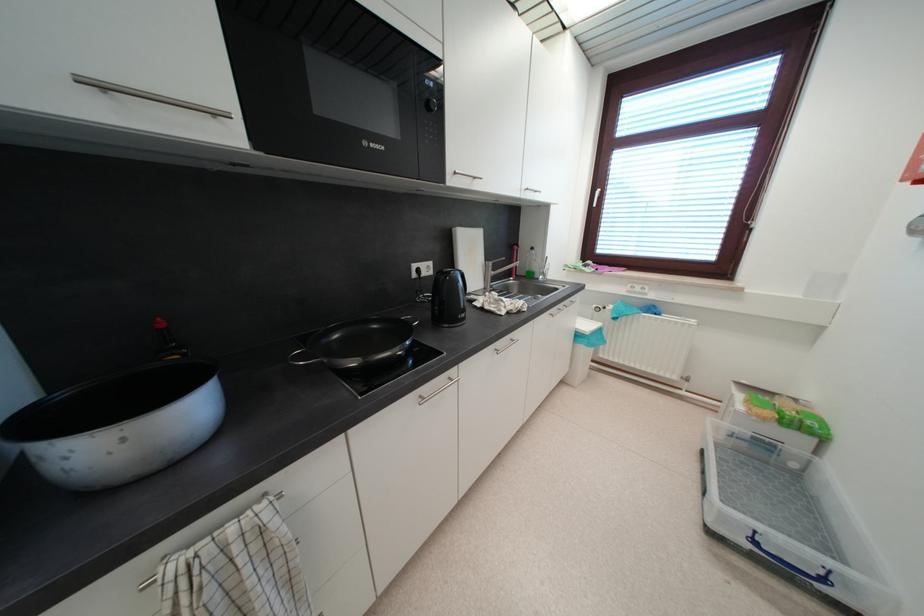
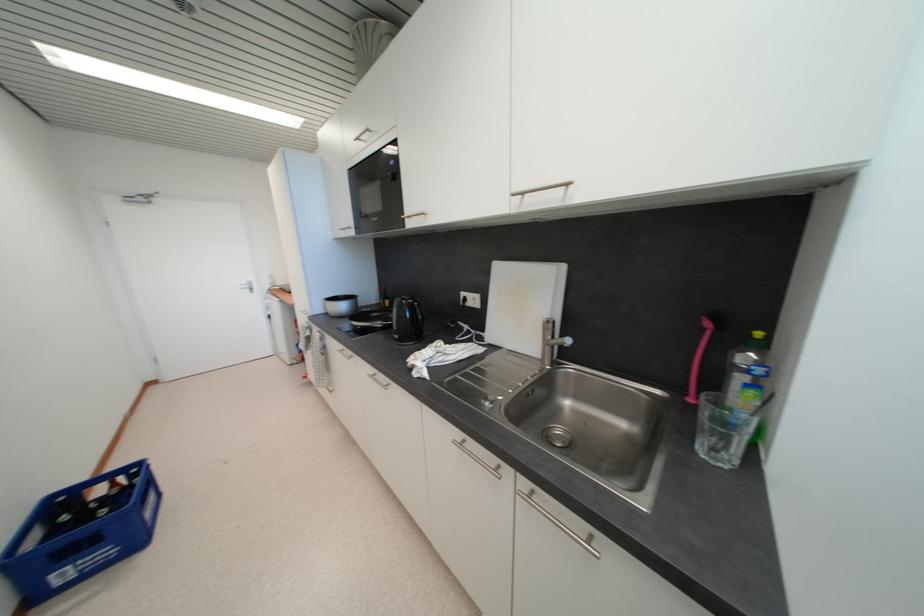
Locate, in the second image, the point that corresponds to pixel 521 251 in the first image.

(713, 326)